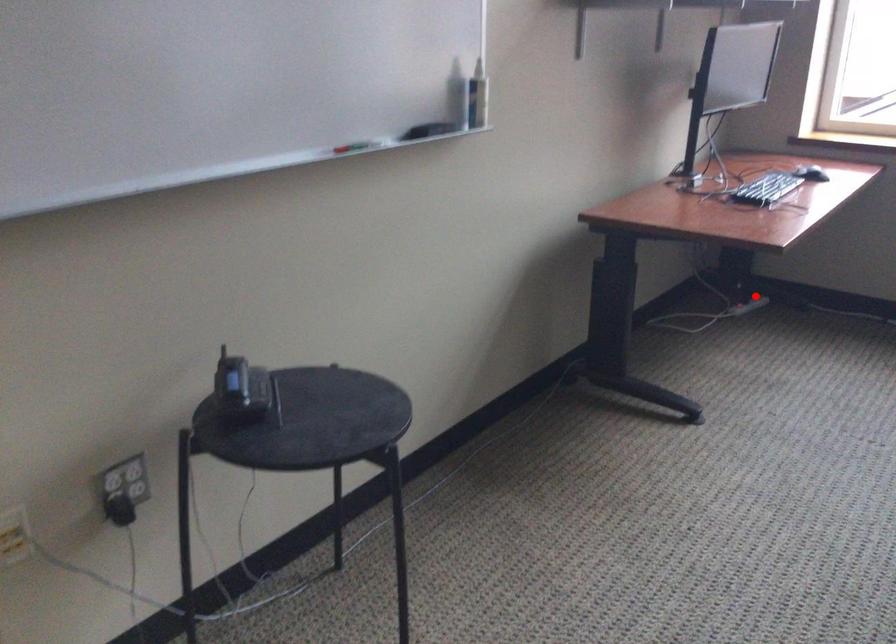
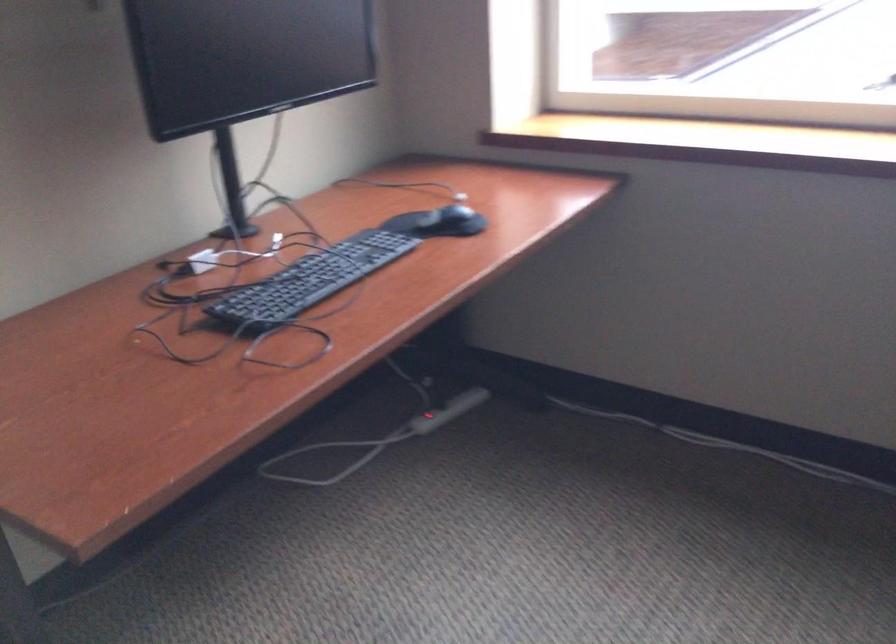
Locate, in the second image, the point that corresponds to the highlighted location in the first image.

(428, 421)